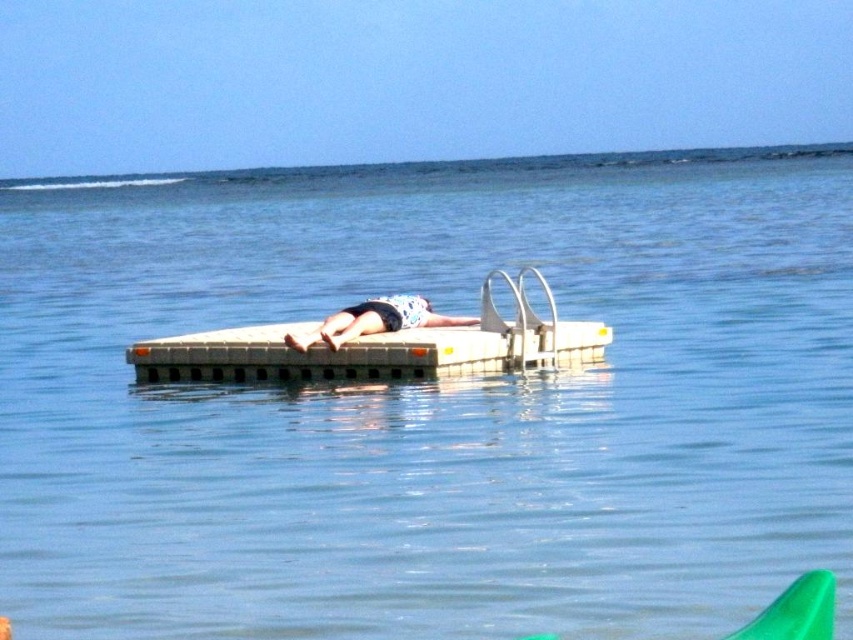
Based on the photo, you are standing on the floating dock and see the point marked at coordinates (379, 346). What object is located at that point?

The point at coordinates (379, 346) corresponds to the white plastic boat at center.

You are planning to place a white plastic boat at center and a floral fabric towel at center on the floating dock. The dock is 2 meters long. Will both items fit on the dock without overlapping?

The white plastic boat at center is 1.34 meters from the floral fabric towel at center. Since the dock is 2 meters long, both items can fit without overlapping as the distance between them is less than the dock length.

You are planning to place both the white plastic boat at center and the floral fabric towel at center on a small table. Which object should you place first to ensure both fit on the table?

Since the white plastic boat at center is smaller than the floral fabric towel at center, you should place the white plastic boat at center first to make space for the larger floral fabric towel at center.